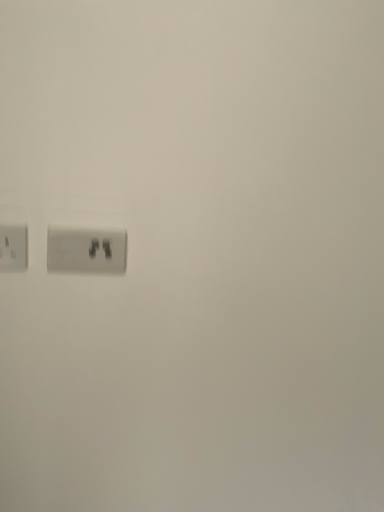
Question: Which direction should I rotate to look at white plastic power plugs and sockets at center, the second power plugs and sockets viewed from the left?

Choices:
 (A) right
 (B) left

Answer: (B)

Question: Does white plastic power plugs and sockets at center, the second power plugs and sockets viewed from the left, have a greater width compared to matte white power plug at left, which is the first power plugs and sockets from left to right?

Choices:
 (A) yes
 (B) no

Answer: (A)

Question: Is matte white power plug at left, which is the first power plugs and sockets from left to right, at the back of white plastic power plugs and sockets at center, the second power plugs and sockets viewed from the left?

Choices:
 (A) no
 (B) yes

Answer: (A)

Question: Is white plastic power plugs and sockets at center, marked as the first power plugs and sockets in a right-to-left arrangement, smaller than matte white power plug at left, the 2th power plugs and sockets viewed from the right?

Choices:
 (A) yes
 (B) no

Answer: (B)

Question: From the image's perspective, is white plastic power plugs and sockets at center, the second power plugs and sockets viewed from the left, located beneath matte white power plug at left, the 2th power plugs and sockets viewed from the right?

Choices:
 (A) yes
 (B) no

Answer: (A)

Question: Are white plastic power plugs and sockets at center, marked as the first power plugs and sockets in a right-to-left arrangement, and matte white power plug at left, the 2th power plugs and sockets viewed from the right, far apart?

Choices:
 (A) no
 (B) yes

Answer: (A)

Question: Is white plastic power plugs and sockets at center, the second power plugs and sockets viewed from the left, shorter than matte white power plug at left, the 2th power plugs and sockets viewed from the right?

Choices:
 (A) no
 (B) yes

Answer: (A)

Question: Is matte white power plug at left, the 2th power plugs and sockets viewed from the right, to the right of white plastic power plugs and sockets at center, marked as the first power plugs and sockets in a right-to-left arrangement, from the viewer's perspective?

Choices:
 (A) no
 (B) yes

Answer: (A)

Question: From a real-world perspective, is matte white power plug at left, which is the first power plugs and sockets from left to right, positioned under white plastic power plugs and sockets at center, marked as the first power plugs and sockets in a right-to-left arrangement, based on gravity?

Choices:
 (A) no
 (B) yes

Answer: (A)

Question: Is white plastic power plugs and sockets at center, the second power plugs and sockets viewed from the left, inside matte white power plug at left, which is the first power plugs and sockets from left to right?

Choices:
 (A) no
 (B) yes

Answer: (A)

Question: Can you confirm if matte white power plug at left, which is the first power plugs and sockets from left to right, is positioned to the left of white plastic power plugs and sockets at center, the second power plugs and sockets viewed from the left?

Choices:
 (A) no
 (B) yes

Answer: (B)

Question: Considering the relative positions of matte white power plug at left, the 2th power plugs and sockets viewed from the right, and white plastic power plugs and sockets at center, marked as the first power plugs and sockets in a right-to-left arrangement, in the image provided, is matte white power plug at left, the 2th power plugs and sockets viewed from the right, behind white plastic power plugs and sockets at center, marked as the first power plugs and sockets in a right-to-left arrangement,?

Choices:
 (A) no
 (B) yes

Answer: (A)

Question: From the image's perspective, is matte white power plug at left, which is the first power plugs and sockets from left to right, located above white plastic power plugs and sockets at center, marked as the first power plugs and sockets in a right-to-left arrangement?

Choices:
 (A) yes
 (B) no

Answer: (A)

Question: Is matte white power plug at left, which is the first power plugs and sockets from left to right, situated inside white plastic power plugs and sockets at center, the second power plugs and sockets viewed from the left, or outside?

Choices:
 (A) inside
 (B) outside

Answer: (B)